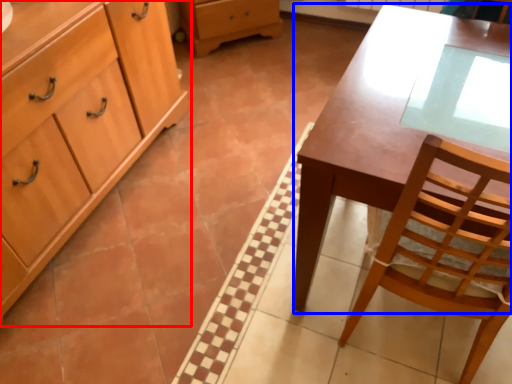
Question: Among these objects, which one is farthest to the camera, cabinetry (highlighted by a red box) or desk (highlighted by a blue box)?

Choices:
 (A) cabinetry
 (B) desk

Answer: (A)